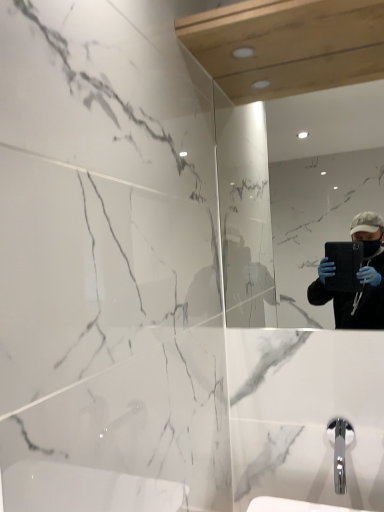
Question: Choose the correct answer: Is chrome metallic faucet at lower right inside matte black tablet at right or outside it?

Choices:
 (A) inside
 (B) outside

Answer: (B)

Question: Is point (336, 466) closer or farther from the camera than point (306, 137)?

Choices:
 (A) closer
 (B) farther

Answer: (A)

Question: Considering the positions of chrome metallic faucet at lower right and matte black tablet at right in the image, is chrome metallic faucet at lower right wider or thinner than matte black tablet at right?

Choices:
 (A) thin
 (B) wide

Answer: (B)

Question: From a real-world perspective, is matte black tablet at right positioned above or below chrome metallic faucet at lower right?

Choices:
 (A) above
 (B) below

Answer: (A)

Question: Based on their sizes in the image, would you say matte black tablet at right is bigger or smaller than chrome metallic faucet at lower right?

Choices:
 (A) big
 (B) small

Answer: (A)

Question: Is matte black tablet at right inside the boundaries of chrome metallic faucet at lower right, or outside?

Choices:
 (A) outside
 (B) inside

Answer: (A)

Question: In terms of width, does matte black tablet at right look wider or thinner when compared to chrome metallic faucet at lower right?

Choices:
 (A) wide
 (B) thin

Answer: (B)